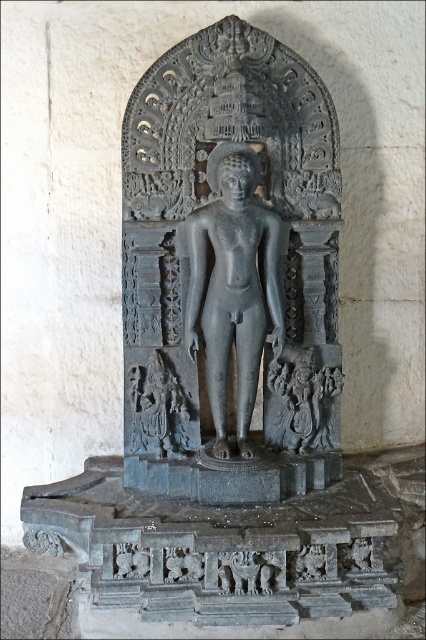
You are an art historian examining two statues in a gallery. You see the black stone statue at center and the gray stone statue at center. Which one is located to the right of the other?

The black stone statue at center is positioned on the right side of gray stone statue at center.

You are a photographer standing in front of the black stone statue at center. Your camera is set to a focal length of 50mm. To capture the statue in full without any cropping, what is the minimum distance you should maintain from the statue?

The black stone statue at center and camera are 2.52 meters apart. To capture the statue in full without cropping, you should maintain at least 2.52 meters distance from the statue.

You are an art conservator examining the stone sculpture in the arched niche. You notice two points on the sculpture marked at coordinates point (x=193, y=243) and point (x=178, y=435). Which of these points is nearer to your viewpoint as you face the sculpture?

Point (x=193, y=243) is closer to the viewer than point (x=178, y=435).